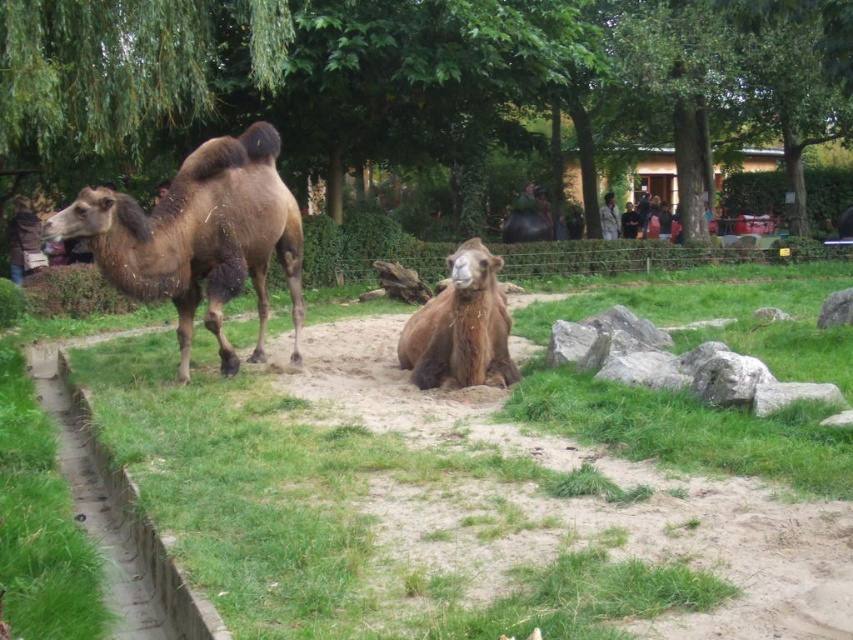
Question: Does green leafy tree at upper center have a smaller size compared to brown fuzzy camel at center?

Choices:
 (A) yes
 (B) no

Answer: (B)

Question: Which point appears closest to the camera in this image?

Choices:
 (A) (170, 38)
 (B) (851, 317)
 (C) (486, 362)

Answer: (C)

Question: Which object is the closest to the brown fuzzy camel at left?

Choices:
 (A) gray rough rock at lower right
 (B) green leafy tree at upper center

Answer: (A)

Question: Does green leafy tree at upper center appear under brown fuzzy camel at center?

Choices:
 (A) yes
 (B) no

Answer: (B)

Question: Which of the following is the farthest from the observer?

Choices:
 (A) gray rough rock at lower right
 (B) brown fuzzy camel at center
 (C) green grass at lower left
 (D) green leafy tree at upper center

Answer: (D)

Question: Can you confirm if green leafy tree at upper center is smaller than brown fuzzy camel at left?

Choices:
 (A) no
 (B) yes

Answer: (A)